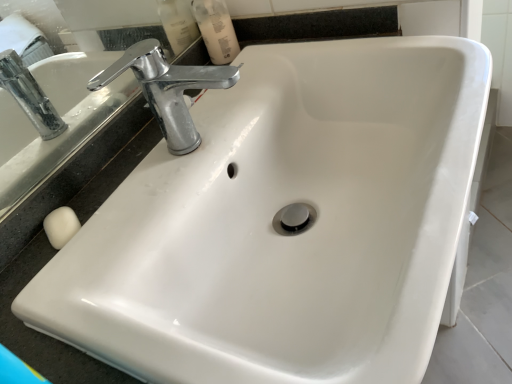
Question: Is chrome metallic faucet at upper left thinner than translucent plastic mouthwash at upper center?

Choices:
 (A) no
 (B) yes

Answer: (A)

Question: Are chrome metallic faucet at upper left and translucent plastic mouthwash at upper center making contact?

Choices:
 (A) no
 (B) yes

Answer: (A)

Question: Is chrome metallic faucet at upper left facing away from translucent plastic mouthwash at upper center?

Choices:
 (A) no
 (B) yes

Answer: (A)

Question: From the image's perspective, is chrome metallic faucet at upper left on top of translucent plastic mouthwash at upper center?

Choices:
 (A) no
 (B) yes

Answer: (A)

Question: Considering the relative sizes of chrome metallic faucet at upper left and translucent plastic mouthwash at upper center in the image provided, is chrome metallic faucet at upper left wider than translucent plastic mouthwash at upper center?

Choices:
 (A) no
 (B) yes

Answer: (B)

Question: Considering the relative sizes of chrome metallic faucet at upper left and translucent plastic mouthwash at upper center in the image provided, is chrome metallic faucet at upper left bigger than translucent plastic mouthwash at upper center?

Choices:
 (A) no
 (B) yes

Answer: (B)

Question: Considering the relative sizes of translucent plastic mouthwash at upper center and chrome metallic faucet at upper left in the image provided, is translucent plastic mouthwash at upper center wider than chrome metallic faucet at upper left?

Choices:
 (A) yes
 (B) no

Answer: (B)

Question: Is translucent plastic mouthwash at upper center positioned behind chrome metallic faucet at upper left?

Choices:
 (A) yes
 (B) no

Answer: (A)

Question: Does translucent plastic mouthwash at upper center contain chrome metallic faucet at upper left?

Choices:
 (A) yes
 (B) no

Answer: (B)

Question: From the image's perspective, is translucent plastic mouthwash at upper center on chrome metallic faucet at upper left?

Choices:
 (A) no
 (B) yes

Answer: (B)

Question: Considering the relative sizes of translucent plastic mouthwash at upper center and chrome metallic faucet at upper left in the image provided, is translucent plastic mouthwash at upper center thinner than chrome metallic faucet at upper left?

Choices:
 (A) yes
 (B) no

Answer: (A)

Question: From a real-world perspective, is translucent plastic mouthwash at upper center on top of chrome metallic faucet at upper left?

Choices:
 (A) no
 (B) yes

Answer: (A)

Question: In the image, is chrome metallic faucet at upper left positioned in front of or behind translucent plastic mouthwash at upper center?

Choices:
 (A) behind
 (B) front

Answer: (B)